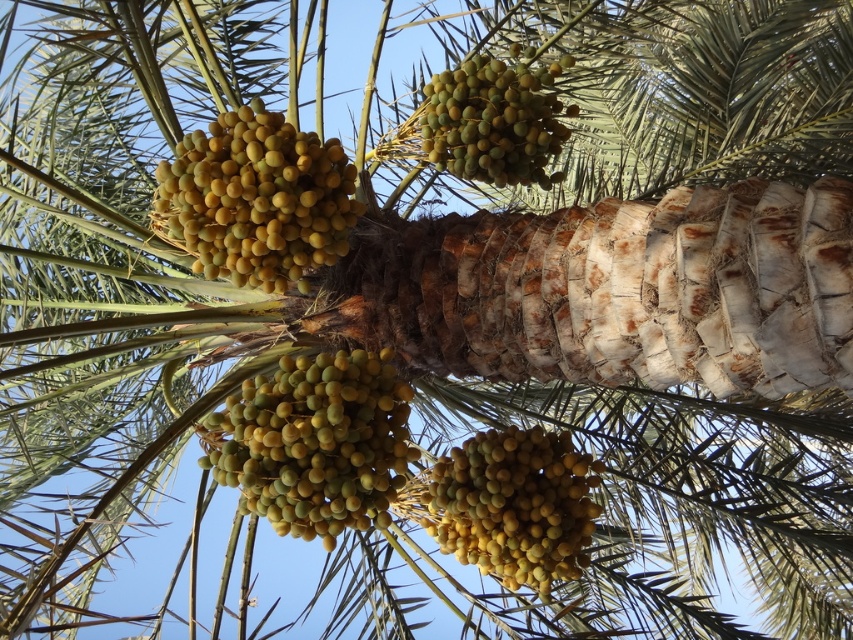
You are standing in a garden and want to pick the yellow matte dates at upper left. If your arm can reach up to 6 feet, will you be able to reach them?

The yellow matte dates at upper left are 7.36 feet away from the viewer, which is beyond the arm reach of 6 feet. You will not be able to reach them.

You are standing in front of a date palm tree and want to pick the yellow matte dates at upper left and yellow matte dates at center. Which cluster of dates is nearer to your hand when you reach out?

The yellow matte dates at upper left are closer to the viewer than the yellow matte dates at center, so the cluster at upper left is nearer to your hand when you reach out.

You are a farmer inspecting the fruit clusters of a date palm tree. You notice two groups of fruits at the center of the image. One is yellow matte fruit at center and the other is green matte dates at center. From your perspective, which group is positioned to the left?

The yellow matte fruit at center is positioned to the left of the green matte dates at center.